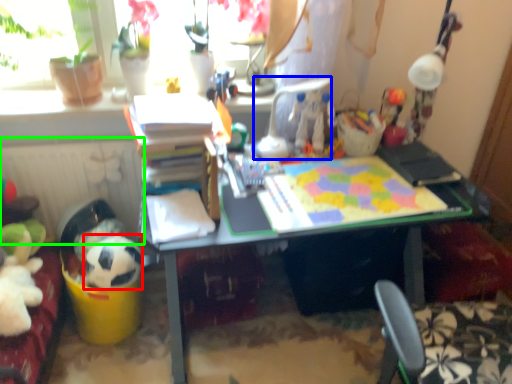
Question: Which object is positioned farthest from animal (highlighted by a red box)? Select from chair (highlighted by a blue box) and radiator (highlighted by a green box).

Choices:
 (A) chair
 (B) radiator

Answer: (A)